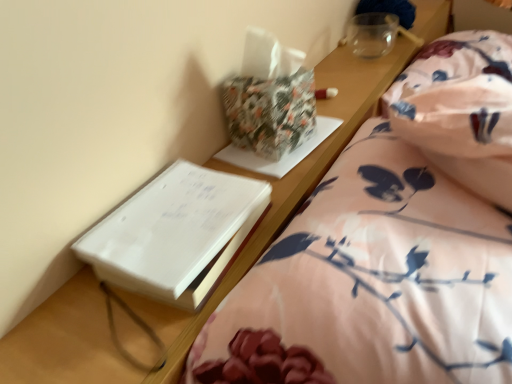
Question: Is there a large distance between floral-patterned paper at upper center and floral cotton blanket at right?

Choices:
 (A) no
 (B) yes

Answer: (A)

Question: Considering the relative positions of floral-patterned paper at upper center and floral cotton blanket at right in the image provided, is floral-patterned paper at upper center to the left of floral cotton blanket at right from the viewer's perspective?

Choices:
 (A) no
 (B) yes

Answer: (B)

Question: Can floral cotton blanket at right be found inside floral-patterned paper at upper center?

Choices:
 (A) no
 (B) yes

Answer: (A)

Question: Is floral-patterned paper at upper center shorter than floral cotton blanket at right?

Choices:
 (A) no
 (B) yes

Answer: (B)

Question: From a real-world perspective, is floral-patterned paper at upper center on top of floral cotton blanket at right?

Choices:
 (A) yes
 (B) no

Answer: (A)

Question: Can you confirm if floral-patterned paper at upper center is smaller than floral cotton blanket at right?

Choices:
 (A) no
 (B) yes

Answer: (B)

Question: Is white paper at left outside floral fabric bed at lower right?

Choices:
 (A) no
 (B) yes

Answer: (B)

Question: Can you confirm if white paper at left is positioned to the left of floral fabric bed at lower right?

Choices:
 (A) no
 (B) yes

Answer: (B)

Question: Can you confirm if white paper at left is wider than floral fabric bed at lower right?

Choices:
 (A) no
 (B) yes

Answer: (A)

Question: Is the depth of white paper at left greater than that of floral fabric bed at lower right?

Choices:
 (A) yes
 (B) no

Answer: (A)

Question: From a real-world perspective, is white paper at left physically above floral fabric bed at lower right?

Choices:
 (A) yes
 (B) no

Answer: (A)

Question: Are white paper at left and floral fabric bed at lower right making contact?

Choices:
 (A) no
 (B) yes

Answer: (A)

Question: Is there a large distance between white paper at left and floral cotton blanket at right?

Choices:
 (A) yes
 (B) no

Answer: (B)